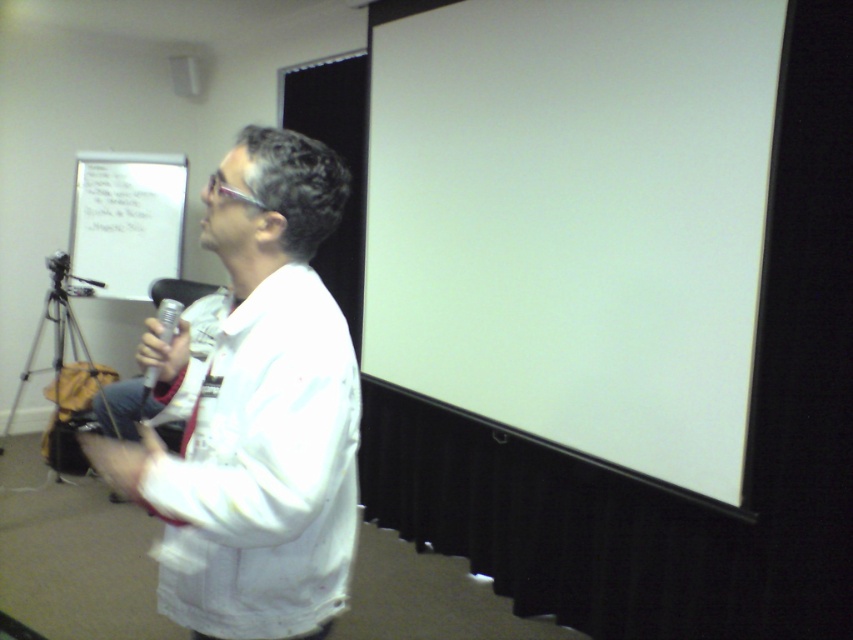
Between white matte projection screen at upper right and white paper at upper left, which one is positioned lower?

white matte projection screen at upper right is below.

Locate an element on the screen. white matte projection screen at upper right is located at coordinates (576, 220).

In order to click on white matte projection screen at upper right in this screenshot , I will do `click(576, 220)`.

Between white matte shirt at center and silver metallic tripod at lower left, which one is positioned lower?

Positioned lower is silver metallic tripod at lower left.

Based on the photo, is white matte shirt at center bigger than silver metallic tripod at lower left?

No.

Does point (328, 188) come in front of point (56, 400)?

Yes, point (328, 188) is in front of point (56, 400).

Find the location of `white matte shirt at center`. white matte shirt at center is located at coordinates (256, 412).

The width and height of the screenshot is (853, 640). What do you see at coordinates (256, 412) in the screenshot?
I see `white matte shirt at center` at bounding box center [256, 412].

Is white matte shirt at center positioned behind metallic silver microphone at center?

That is False.

Is point (349, 387) closer to camera compared to point (166, 308)?

Yes, it is.

Locate an element on the screen. The image size is (853, 640). white matte shirt at center is located at coordinates (256, 412).